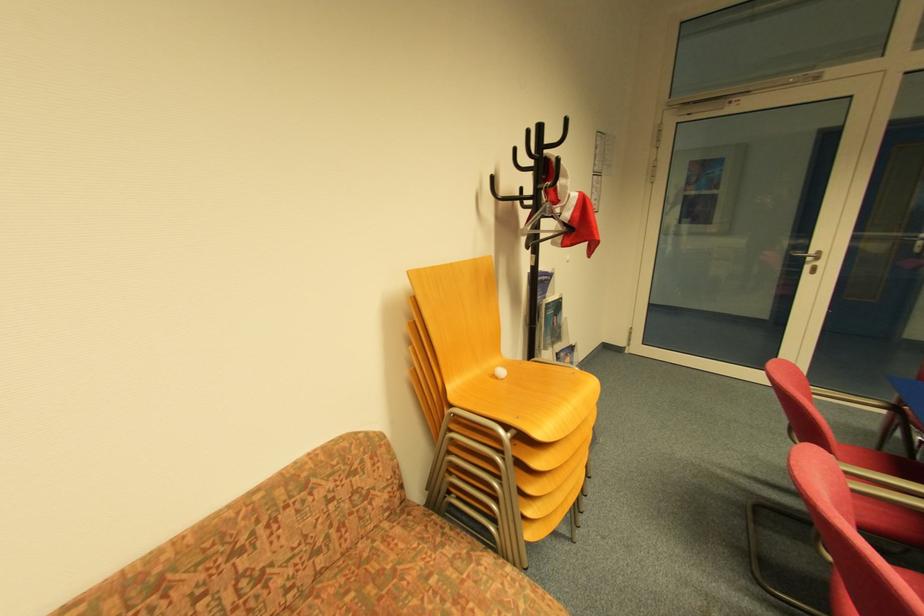
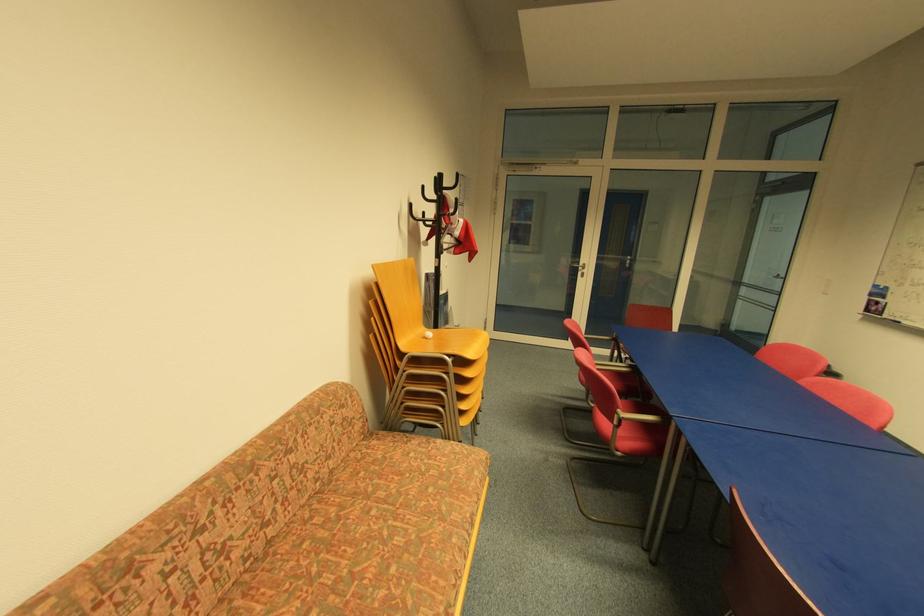
Where in the second image is the point corresponding to point (391, 516) from the first image?

(367, 438)